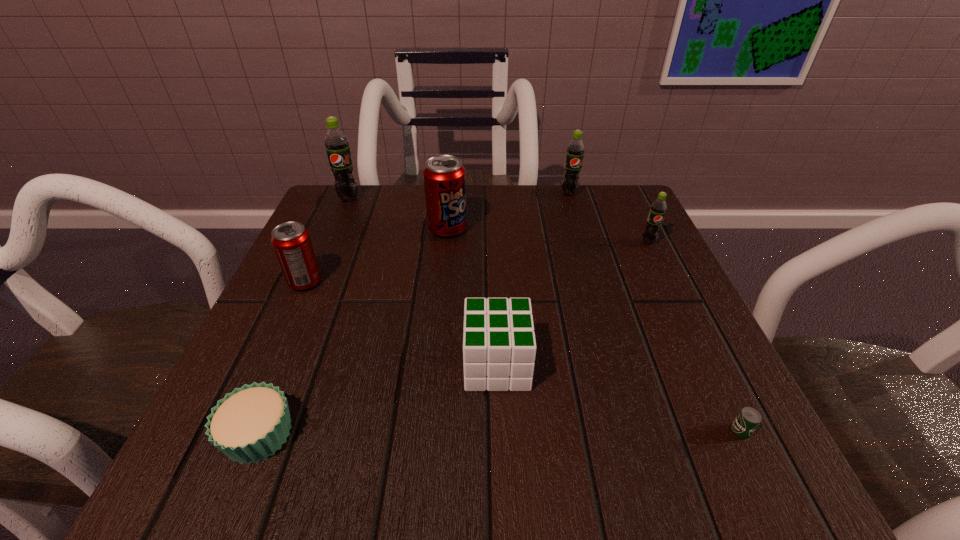
Where is `red cube`? Image resolution: width=960 pixels, height=540 pixels. red cube is located at coordinates (499, 347).

Locate an element on the screen. The width and height of the screenshot is (960, 540). cube is located at coordinates (499, 347).

Find the location of a particular element. the seventh tallest object is located at coordinates (248, 425).

Image resolution: width=960 pixels, height=540 pixels. Identify the location of beer can. (748, 419).

Identify the location of vacant region located 0.280m on the front label of the tallest object. This screenshot has width=960, height=540. (312, 286).

Locate an element on the screen. vacant space situated on the left of the fifth object from right to left is located at coordinates (400, 229).

At what (x,y) coordinates should I click in order to perform the action: click on vacant space located 0.100m on the front label of the second green soda from left to right. Please return your answer as a coordinate pair (x, y). Image resolution: width=960 pixels, height=540 pixels. Looking at the image, I should click on (578, 221).

Image resolution: width=960 pixels, height=540 pixels. What are the coordinates of `free spot located on the front label of the rightmost soda can` in the screenshot? It's located at (689, 327).

Image resolution: width=960 pixels, height=540 pixels. What are the coordinates of `vacant space located on the right of the left red soda can` in the screenshot? It's located at (445, 282).

This screenshot has height=540, width=960. I want to click on vacant space located 0.110m on the red face of the fifth object from left to right, so click(394, 365).